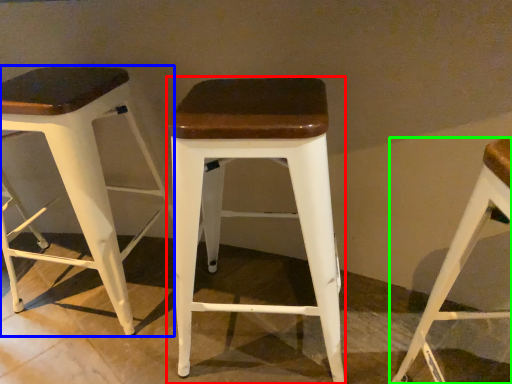
Question: Which is nearer to the stool (highlighted by a red box)? stool (highlighted by a blue box) or stool (highlighted by a green box).

Choices:
 (A) stool
 (B) stool

Answer: (B)